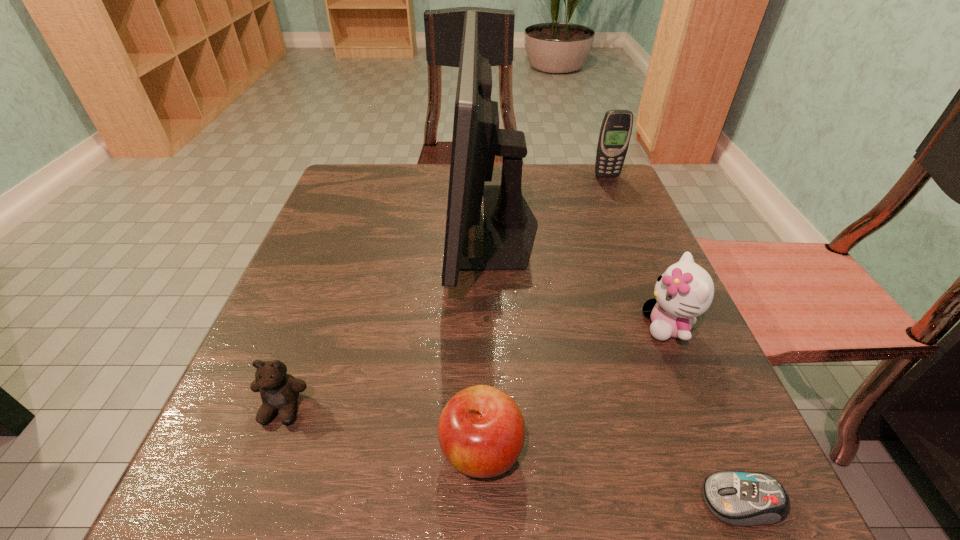
This screenshot has width=960, height=540. In the image, there is a desktop. Identify the location of free space at the left edge. (266, 447).

At what (x,y) coordinates should I click in order to perform the action: click on vacant space at the right edge. Please return your answer as a coordinate pair (x, y). Looking at the image, I should click on (602, 215).

This screenshot has height=540, width=960. Find the location of `vacant space at the far right corner of the desktop`. vacant space at the far right corner of the desktop is located at coordinates (625, 188).

Find the location of a particular element. free spot between the fourth shortest object and the cellular telephone is located at coordinates (637, 251).

Locate an element on the screen. This screenshot has width=960, height=540. vacant area that lies between the cellular telephone and the apple is located at coordinates (544, 313).

Where is `free space between the computer mouse and the cellular telephone`? free space between the computer mouse and the cellular telephone is located at coordinates (674, 339).

Where is `vacant area that lies between the tallest object and the kitten`? The height and width of the screenshot is (540, 960). vacant area that lies between the tallest object and the kitten is located at coordinates (581, 275).

You are a GUI agent. You are given a task and a screenshot of the screen. Output one action in this format:
    pyautogui.click(x=<x>, y=<y>)
    Task: Click on the vacant area that lies between the cellular telephone and the fourth shortest object
    Image resolution: width=960 pixels, height=540 pixels.
    Given the screenshot: What is the action you would take?
    pyautogui.click(x=637, y=251)

The width and height of the screenshot is (960, 540). I want to click on vacant space that's between the computer mouse and the third tallest object, so click(x=706, y=413).

I want to click on free space between the shortest object and the apple, so click(612, 476).